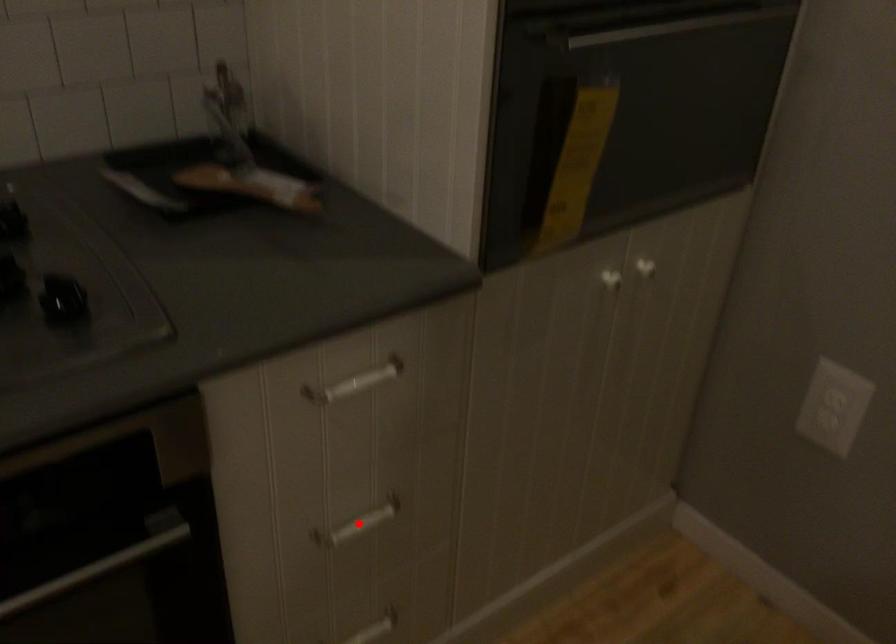
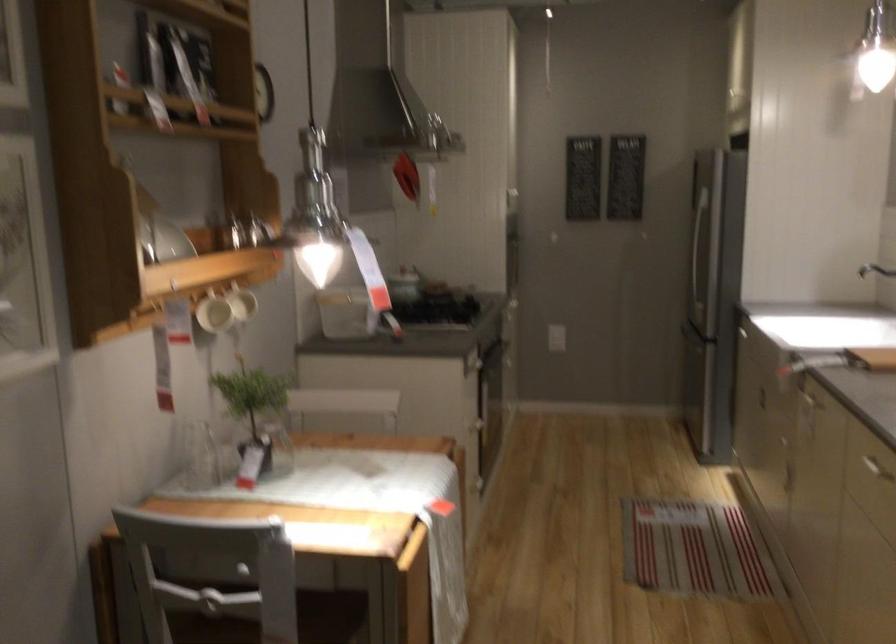
Question: I am providing you with two images of the same scene from different viewpoints. A red point is marked on the first image. At the location where the point appears in image 1, is it still visible in image 2?

Choices:
 (A) Yes
 (B) No

Answer: (B)